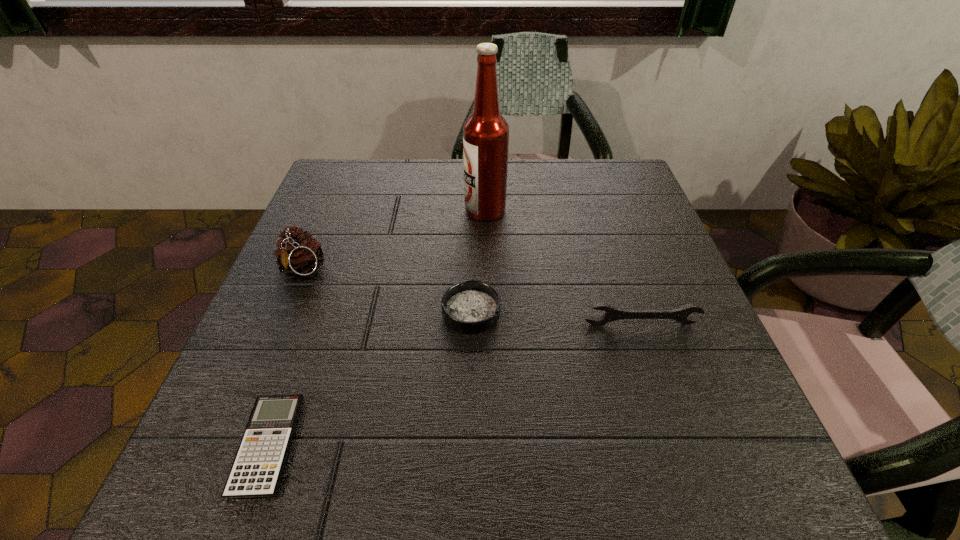
Locate an element on the screen. This screenshot has height=540, width=960. object present at the near left corner is located at coordinates (256, 472).

In the image, there is a desktop. At what (x,y) coordinates should I click in order to perform the action: click on free space at the far edge. Please return your answer as a coordinate pair (x, y). Looking at the image, I should click on (400, 193).

This screenshot has width=960, height=540. I want to click on free space at the left edge, so click(340, 278).

Where is `free space at the right edge of the desktop`? The image size is (960, 540). free space at the right edge of the desktop is located at coordinates (705, 341).

Image resolution: width=960 pixels, height=540 pixels. In the image, there is a desktop. Identify the location of free region at the far left corner. (325, 183).

Locate an element on the screen. This screenshot has width=960, height=540. vacant area at the near left corner of the desktop is located at coordinates (195, 465).

At what (x,y) coordinates should I click in order to perform the action: click on free spot at the far right corner of the desktop. Please return your answer as a coordinate pair (x, y). Looking at the image, I should click on (585, 198).

Identify the location of free space between the tallest object and the second shortest object. The height and width of the screenshot is (540, 960). (478, 261).

Find the location of a particular element. The width and height of the screenshot is (960, 540). free space that is in between the alcohol and the second shortest object is located at coordinates click(478, 261).

This screenshot has height=540, width=960. Identify the location of vacant area that lies between the shortest object and the rightmost object. (454, 384).